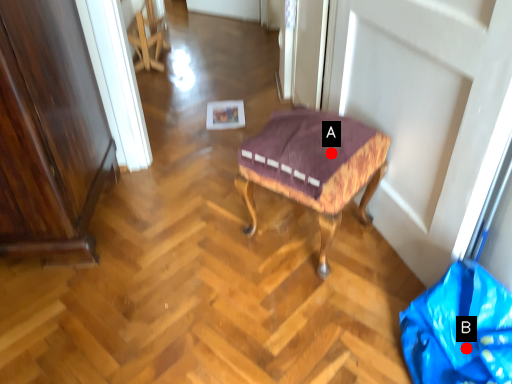
Question: Two points are circled on the image, labeled by A and B beside each circle. Among these points, which one is nearest to the camera?

Choices:
 (A) A is closer
 (B) B is closer

Answer: (B)